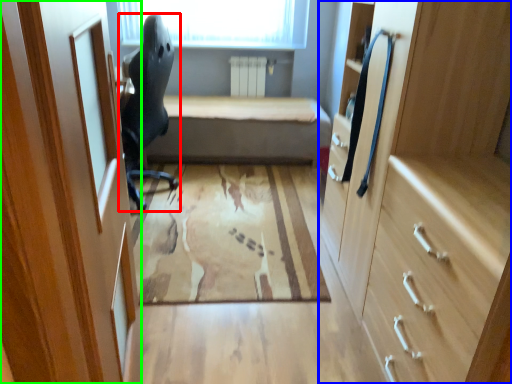
Question: Based on their relative distances, which object is nearer to chair (highlighted by a red box)? Choose from cabinetry (highlighted by a blue box) and door (highlighted by a green box).

Choices:
 (A) cabinetry
 (B) door

Answer: (B)